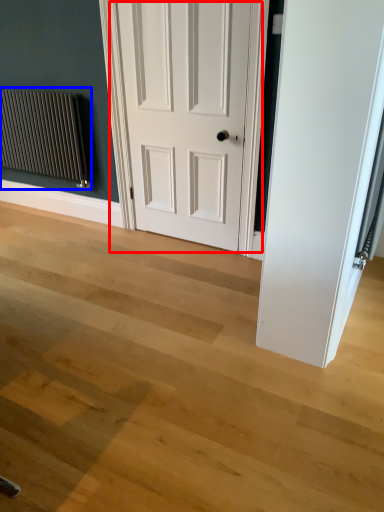
Question: Among these objects, which one is farthest to the camera, door (highlighted by a red box) or radiator (highlighted by a blue box)?

Choices:
 (A) door
 (B) radiator

Answer: (B)